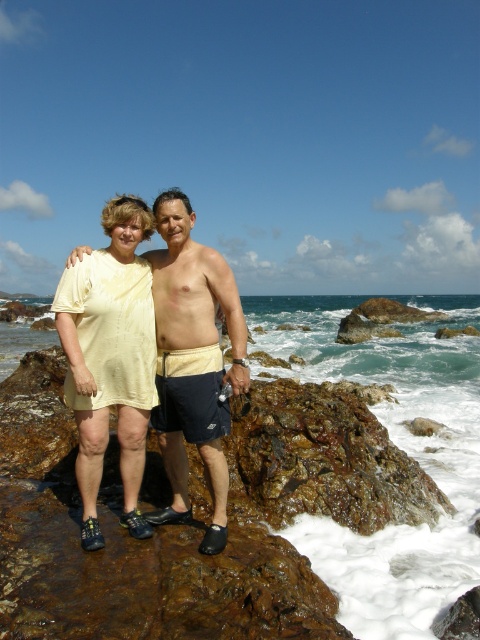
You are a photographer planning to capture a landscape shot of the clear blue water at center and the beige cotton shirt at center. Since you want both subjects to be clearly visible, which one should you focus on first to ensure proper exposure?

The clear blue water at center is larger in size than the beige cotton shirt at center, so you should focus on the clear blue water at center first to ensure proper exposure.

You are a photographer trying to capture a photo of both the matte yellow dress at center and the beige cotton shirt at center. Based on their positions, which one is lower in the image?

The matte yellow dress at center is located below the beige cotton shirt at center, so it is lower in the image.